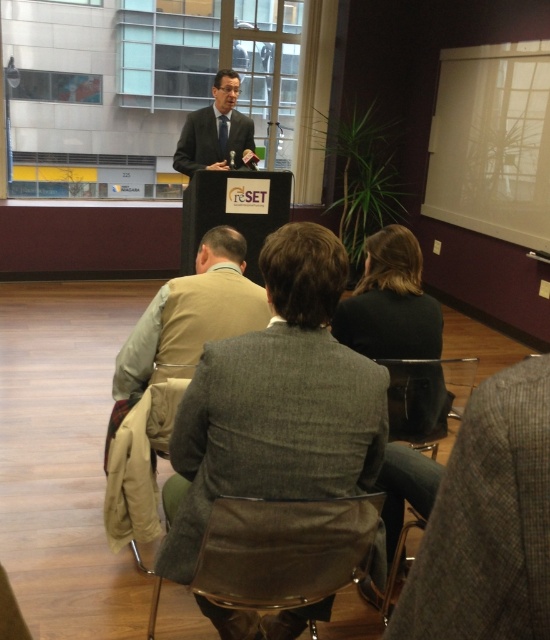
Question: Which point is farther to the camera?

Choices:
 (A) (116, 358)
 (B) (257, 378)
 (C) (222, 102)

Answer: (C)

Question: Among these objects, which one is farthest from the camera?

Choices:
 (A) matte black suit at center
 (B) tan fabric jacket at center
 (C) gray wool blazer at center
 (D) black fabric jacket at center

Answer: (A)

Question: Can you confirm if tan fabric jacket at center is thinner than matte black suit at center?

Choices:
 (A) yes
 (B) no

Answer: (B)

Question: Can you confirm if gray wool blazer at center is positioned to the left of matte black suit at center?

Choices:
 (A) no
 (B) yes

Answer: (A)

Question: Which of the following is the farthest from the observer?

Choices:
 (A) gray wool blazer at center
 (B) tan fabric jacket at center
 (C) matte black suit at center
 (D) black leather chair at center

Answer: (C)

Question: Is black leather chair at center closer to camera compared to matte black suit at center?

Choices:
 (A) no
 (B) yes

Answer: (B)